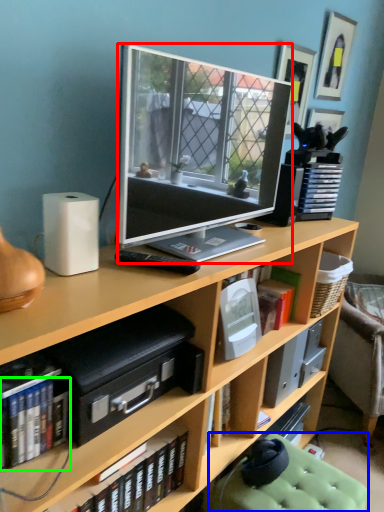
Question: Considering the real-world distances, which object is farthest from television (highlighted by a red box)? swivel chair (highlighted by a blue box) or book (highlighted by a green box)?

Choices:
 (A) swivel chair
 (B) book

Answer: (A)